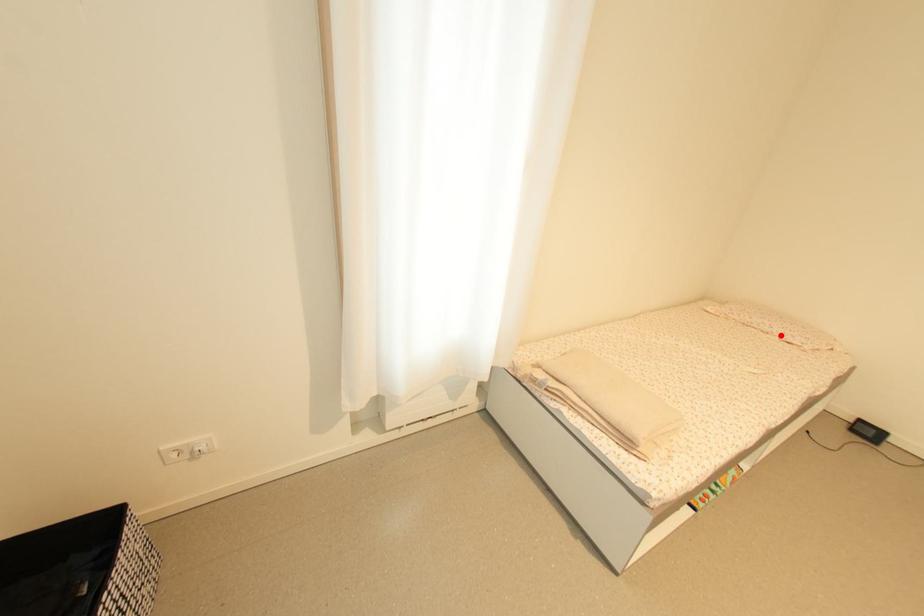
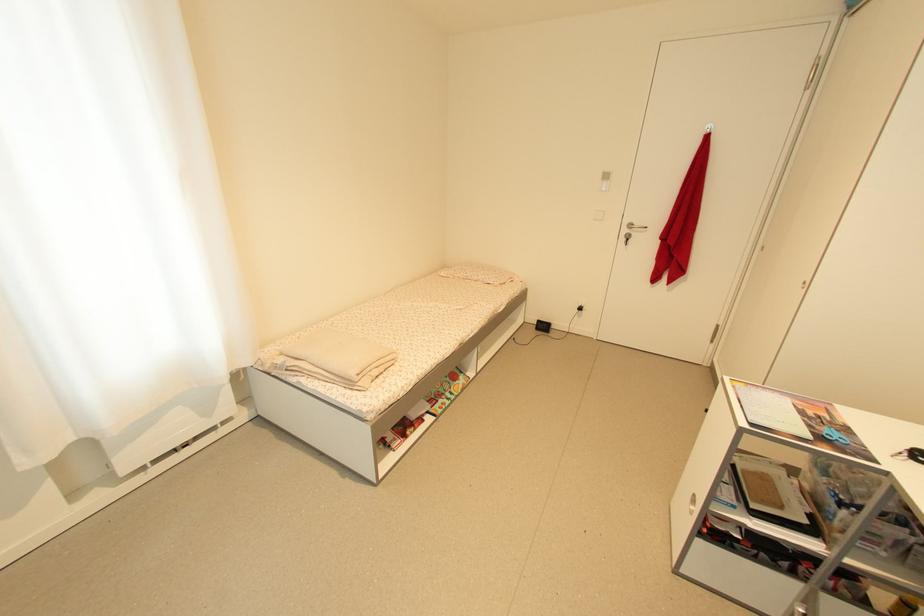
In the second image, find the point that corresponds to the highlighted location in the first image.

(485, 282)